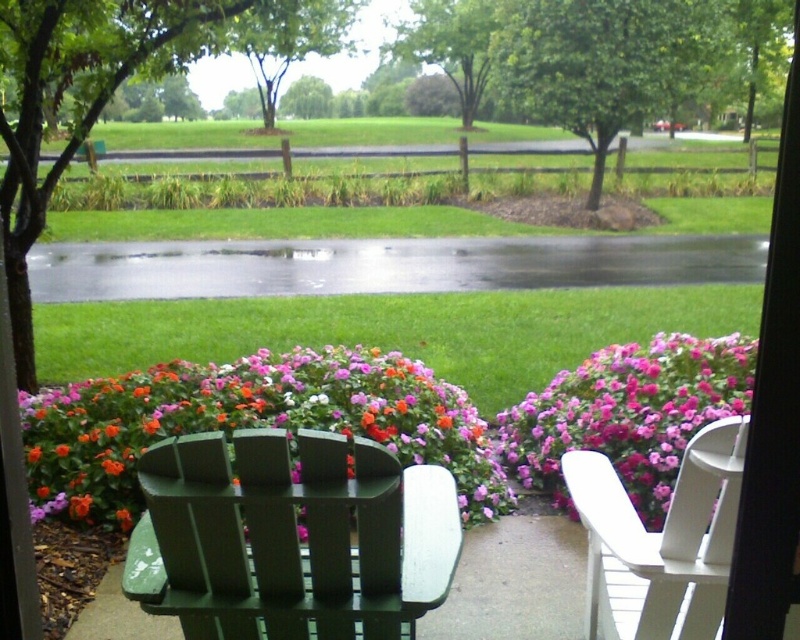
You are standing inside the building looking out at the garden. There are two points marked in the scene. The first point is at coordinates point (358, 577) and the second is at point (698, 355). Which point is closer to you?

Point (358, 577) is in front of point (698, 355), so it is closer to you.

You are standing in a building and looking out through a window. You see a green painted wood chair at lower center. Can you reach it without leaving the building?

The green painted wood chair at lower center is 6.44 feet away from you, but since you are inside the building and it is outside, you cannot reach it without exiting the building.

You are sitting in the green painted wood chair at lower center and want to place a book on the vibrant floral bush at center. Is the book within easy reach from your current position?

The green painted wood chair at lower center is shorter than the vibrant floral bush at center, so the book may be difficult to place as the bush is taller than the chair.